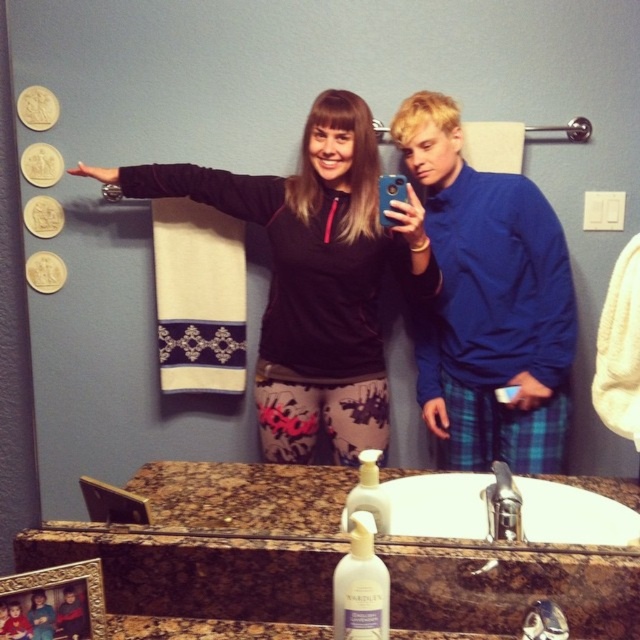
Question: Does black fleece sweatshirt at center have a smaller size compared to blue sweater at center?

Choices:
 (A) yes
 (B) no

Answer: (B)

Question: Which is farther from the blue sweater at center?

Choices:
 (A) black fleece sweatshirt at center
 (B) white ceramic sink at center

Answer: (B)

Question: Based on their relative distances, which object is nearer to the black fleece sweatshirt at center?

Choices:
 (A) white ceramic sink at center
 (B) blue sweater at center

Answer: (B)

Question: Can you confirm if blue sweater at center is thinner than white ceramic sink at center?

Choices:
 (A) yes
 (B) no

Answer: (A)

Question: Is black fleece sweatshirt at center positioned at the back of blue sweater at center?

Choices:
 (A) no
 (B) yes

Answer: (A)

Question: Among these objects, which one is farthest from the camera?

Choices:
 (A) black fleece sweatshirt at center
 (B) white ceramic sink at center
 (C) blue sweater at center

Answer: (C)